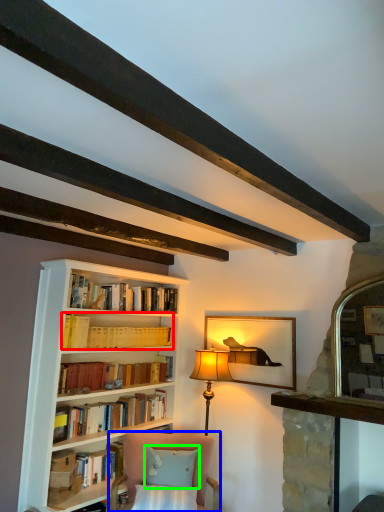
Question: Which is nearer to the book (highlighted by a red box)? chair (highlighted by a blue box) or pillow (highlighted by a green box).

Choices:
 (A) chair
 (B) pillow

Answer: (A)